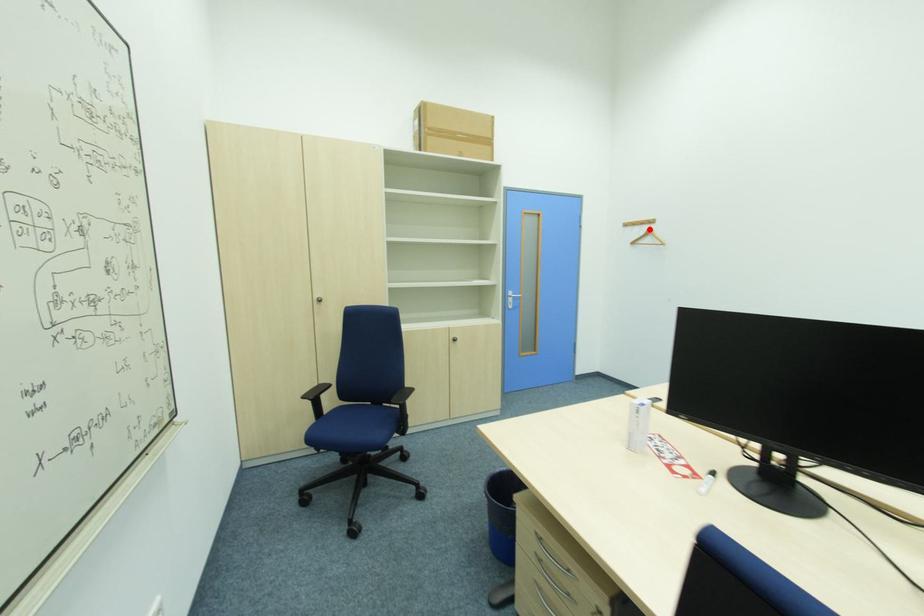
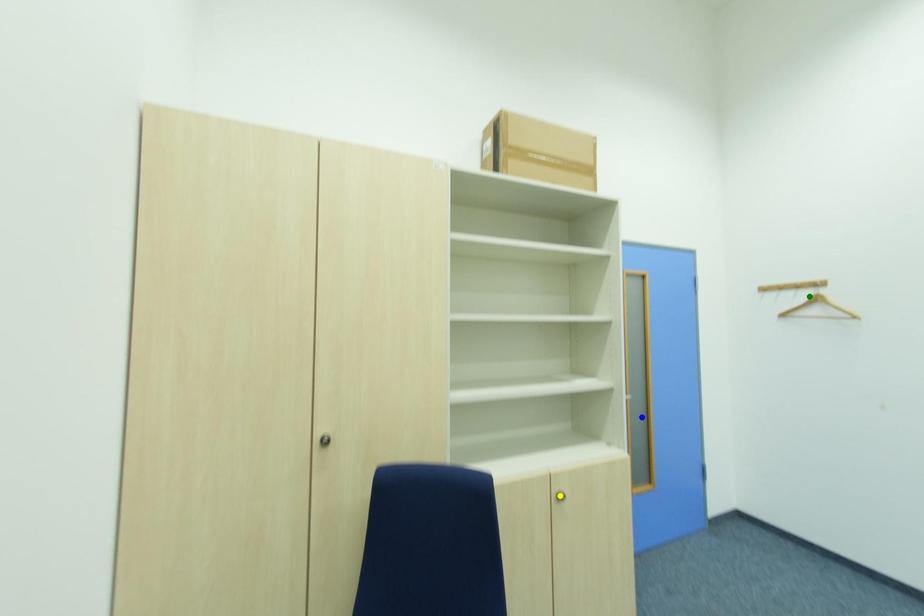
Question: I am providing you with two images of the same scene from different viewpoints. A red point is marked on the first image. You are given multiple points on the second image. Which point in image 2 represents the same 3d spot as the red point in image 1?

Choices:
 (A) blue point
 (B) yellow point
 (C) green point

Answer: (C)